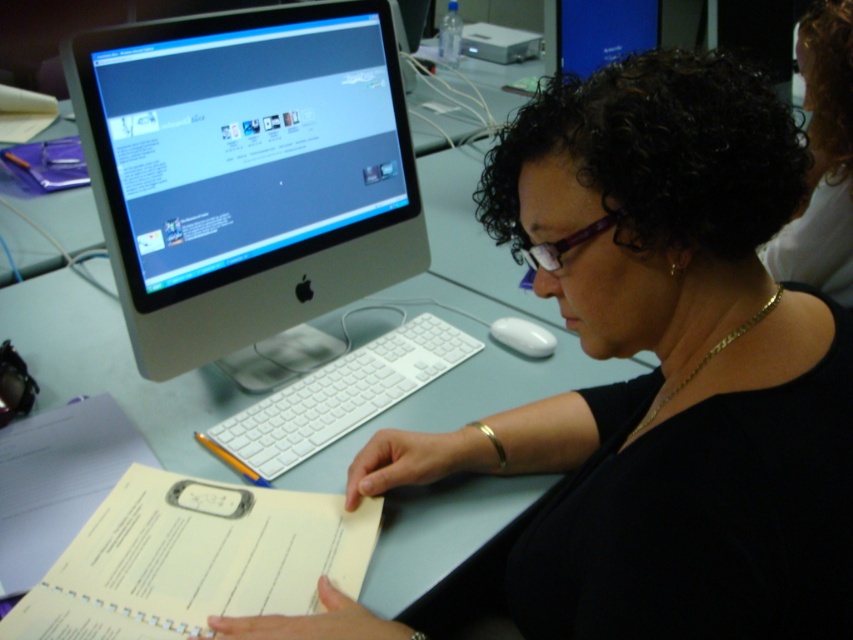
You are a delivery person who needs to place a small box on the desk without blocking the view of the black matte computer monitor at upper left. The box will be placed 18 inches away from the monitor. Is this placement possible?

The black matte computer monitor at upper left is 19.63 inches away from the camera. Placing the box 18 inches away from the monitor would mean the box is closer to the camera than the monitor, so it would not block the monitor. Therefore, this placement is possible.

You are a photographer taking a picture of the desk setup. You notice two points marked on the desk surface. Which point is closer to you, point (604, 637) or point (386, 333)?

Point (604, 637) is closer to the viewer than point (386, 333).